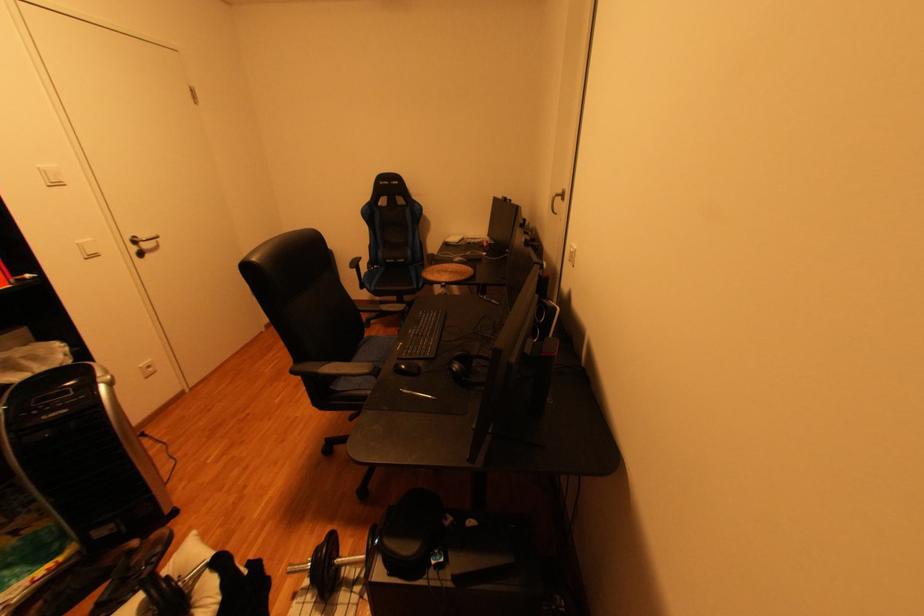
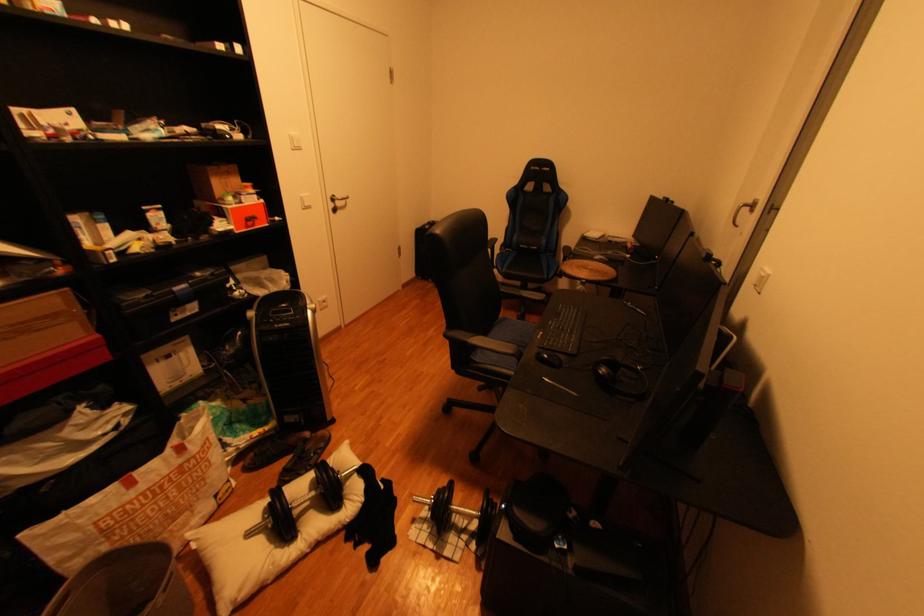
The point at (464, 370) is marked in the first image. Where is the corresponding point in the second image?

(611, 373)